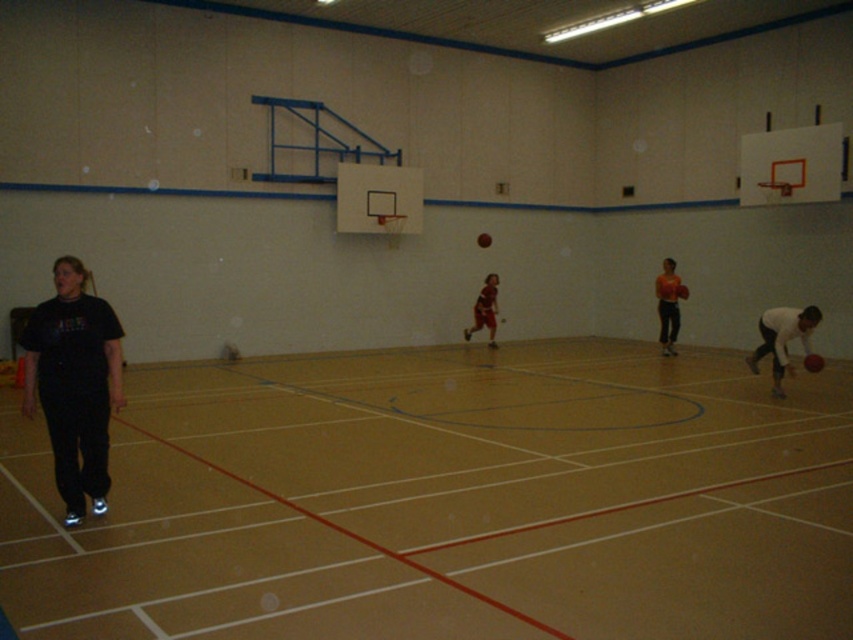
Which is more to the right, black matte t-shirt at left or rubber basketball at center?

rubber basketball at center is more to the right.

Can you confirm if black matte t-shirt at left is positioned to the right of rubber basketball at center?

In fact, black matte t-shirt at left is to the left of rubber basketball at center.

Is point (70, 324) positioned in front of point (485, 237)?

Yes, point (70, 324) is in front of point (485, 237).

The height and width of the screenshot is (640, 853). I want to click on black matte t-shirt at left, so click(74, 384).

Is matte brown shorts at center to the left of shiny red basketball at lower right from the viewer's perspective?

Indeed, matte brown shorts at center is positioned on the left side of shiny red basketball at lower right.

The image size is (853, 640). What do you see at coordinates (485, 308) in the screenshot?
I see `matte brown shorts at center` at bounding box center [485, 308].

Image resolution: width=853 pixels, height=640 pixels. I want to click on matte brown shorts at center, so click(485, 308).

Is the position of black matte t-shirt at left more distant than that of matte brown shorts at center?

No.

Who is more forward, (67, 268) or (488, 289)?

Point (67, 268)

Find the location of a particular element. black matte t-shirt at left is located at coordinates (74, 384).